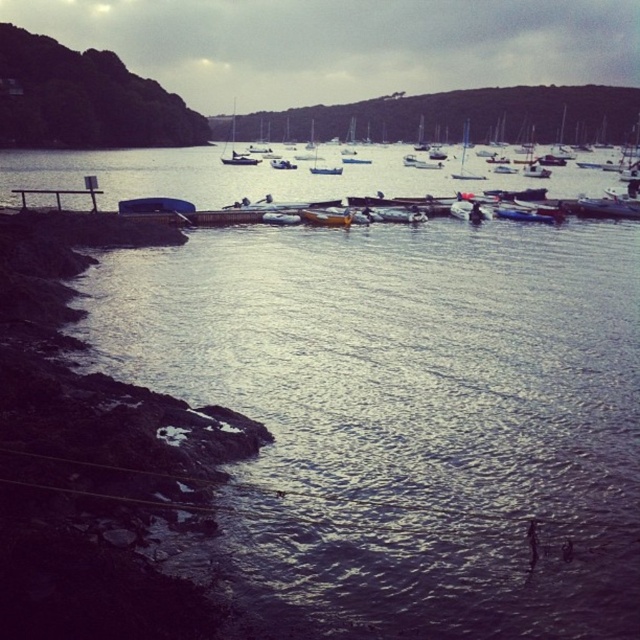
Question: Which point is closer to the camera?

Choices:
 (A) white sailboat at center
 (B) yellow plastic boat at center
 (C) white plastic sailboat at center
 (D) wooden dock at left

Answer: (D)

Question: In this image, where is wooden dock at left located relative to white sailboat at center?

Choices:
 (A) above
 (B) below

Answer: (B)

Question: Which object appears closest to the camera in this image?

Choices:
 (A) yellow plastic boat at center
 (B) wooden dock at left
 (C) white plastic sailboat at center
 (D) white sailboat at center

Answer: (B)

Question: Is wooden dock at left further to the viewer compared to white sailboat at center?

Choices:
 (A) no
 (B) yes

Answer: (A)

Question: Which point is farther to the camera?

Choices:
 (A) white sailboat at center
 (B) wooden dock at left
 (C) white plastic sailboat at center
 (D) yellow plastic boat at center

Answer: (A)

Question: Where is white sailboat at center located in relation to white plastic sailboat at center in the image?

Choices:
 (A) left
 (B) right

Answer: (A)